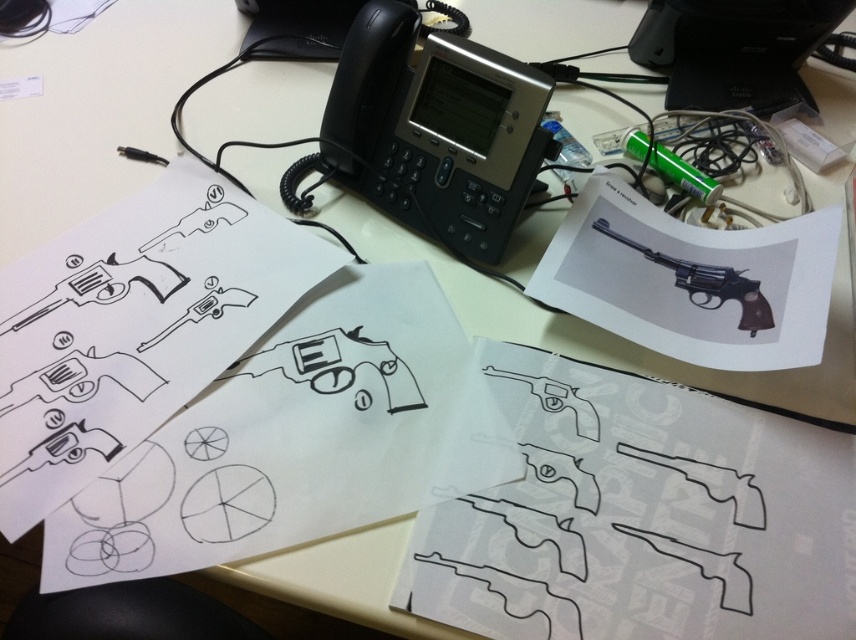
Question: Which object is the farthest from the black line drawing revolver at center?

Choices:
 (A) black plastic phone at center
 (B) black rubber revolver at upper right
 (C) black paper at upper left
 (D) black paper at center

Answer: (B)

Question: Is black plastic phone at center wider than black rubber revolver at upper right?

Choices:
 (A) yes
 (B) no

Answer: (A)

Question: Among these objects, which one is farthest from the camera?

Choices:
 (A) black rubber revolver at upper right
 (B) black paper at center

Answer: (A)

Question: Based on their relative distances, which object is farther from the black line drawing revolver at upper left?

Choices:
 (A) black plastic phone at center
 (B) black paper at center

Answer: (A)

Question: Is black paper at center further to the viewer compared to matte black revolver at upper right?

Choices:
 (A) yes
 (B) no

Answer: (B)

Question: Can you confirm if black line drawing revolver at upper left is bigger than black line drawing revolver at center?

Choices:
 (A) no
 (B) yes

Answer: (B)